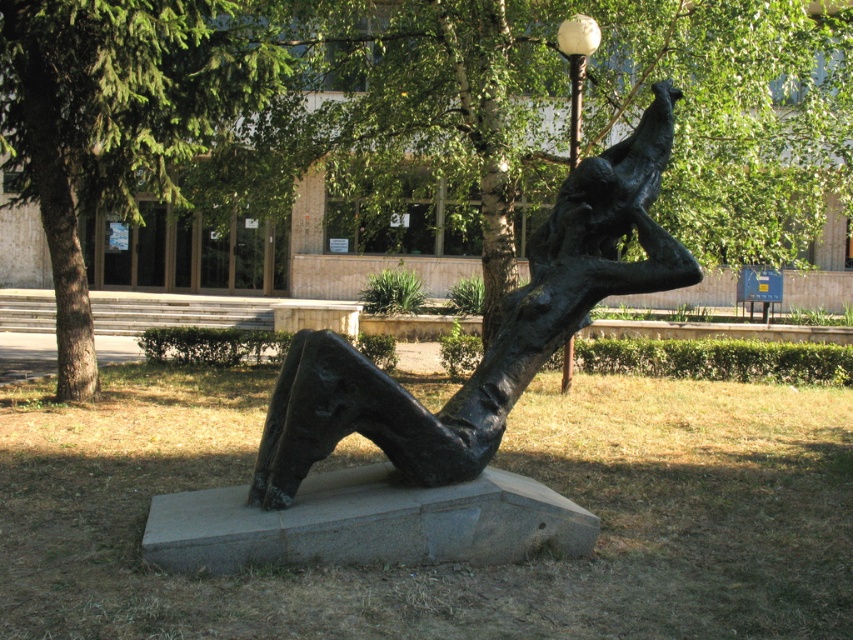
Question: Considering the relative positions of green leafy tree at upper left and white glass ball at upper center in the image provided, where is green leafy tree at upper left located with respect to white glass ball at upper center?

Choices:
 (A) below
 (B) above

Answer: (A)

Question: Which object is closer to the camera taking this photo?

Choices:
 (A) green leafy tree at upper left
 (B) white glass ball at upper center
 (C) bronze statue at center
 (D) green leafy tree at upper center

Answer: (C)

Question: Which of the following is the farthest from the observer?

Choices:
 (A) click(152, 88)
 (B) click(669, 179)
 (C) click(334, 380)

Answer: (B)

Question: Estimate the real-world distances between objects in this image. Which object is farther from the white glass ball at upper center?

Choices:
 (A) green leafy tree at upper left
 (B) bronze statue at center
 (C) green leafy tree at upper center

Answer: (C)

Question: Does green leafy tree at upper left come behind white glass ball at upper center?

Choices:
 (A) yes
 (B) no

Answer: (B)

Question: Is green leafy tree at upper left to the left of bronze statue at center from the viewer's perspective?

Choices:
 (A) yes
 (B) no

Answer: (A)